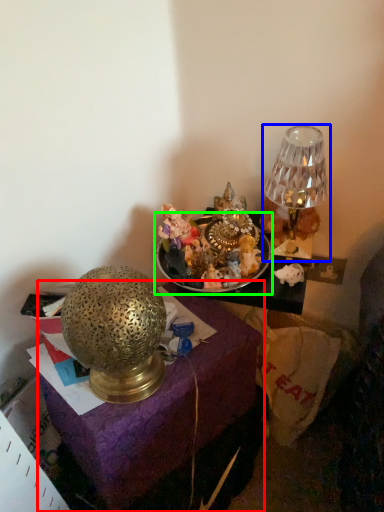
Question: Which object is positioned farthest from furniture (highlighted by a red box)? Select from lamp (highlighted by a blue box) and tableware (highlighted by a green box).

Choices:
 (A) lamp
 (B) tableware

Answer: (A)